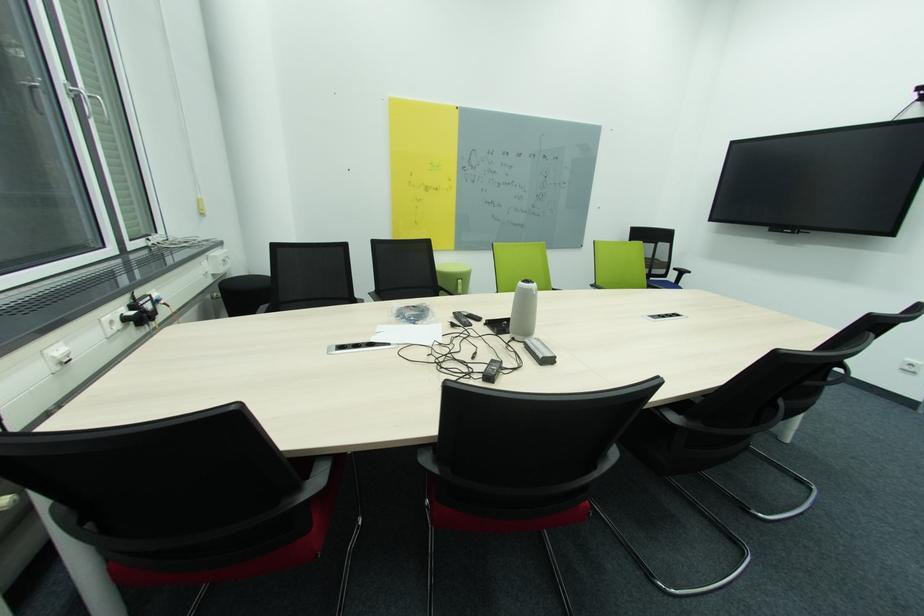
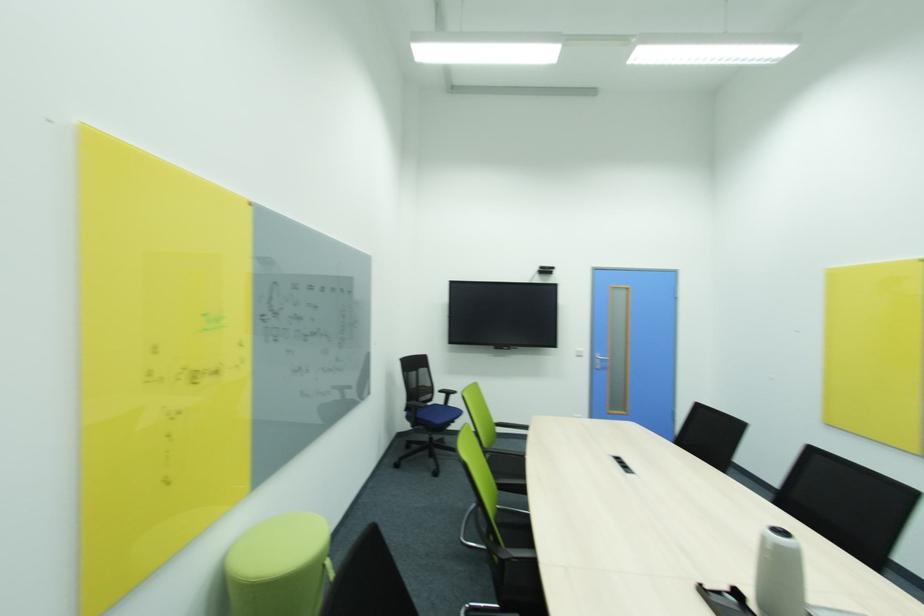
In the second image, find the point that corresponds to point (667, 246) in the first image.

(428, 371)